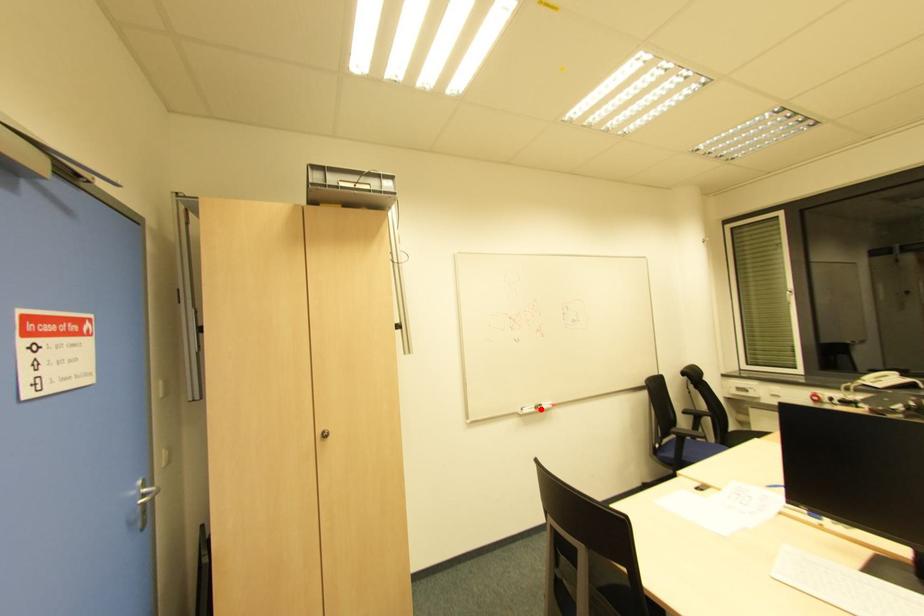
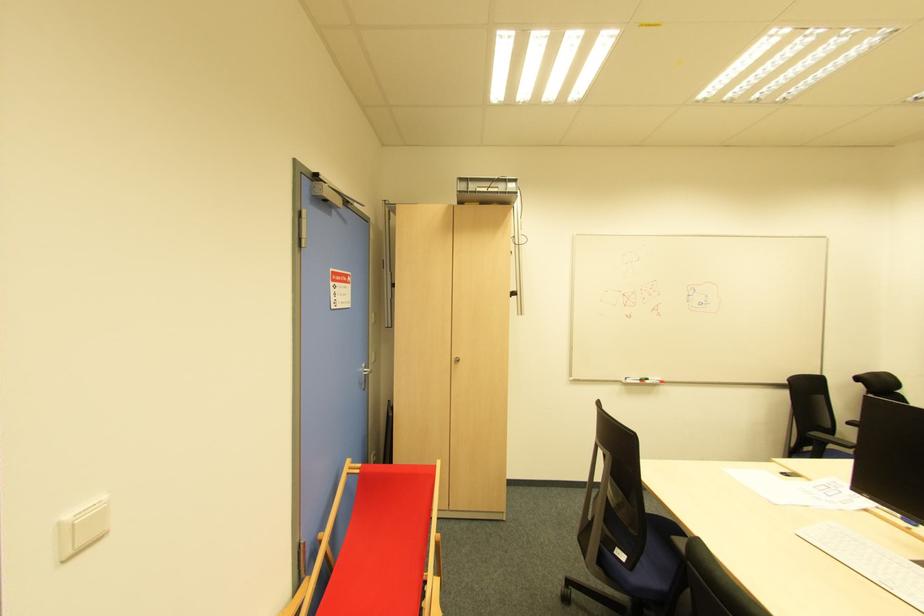
Find the pixel in the second image that matches the highlighted location in the first image.

(647, 383)